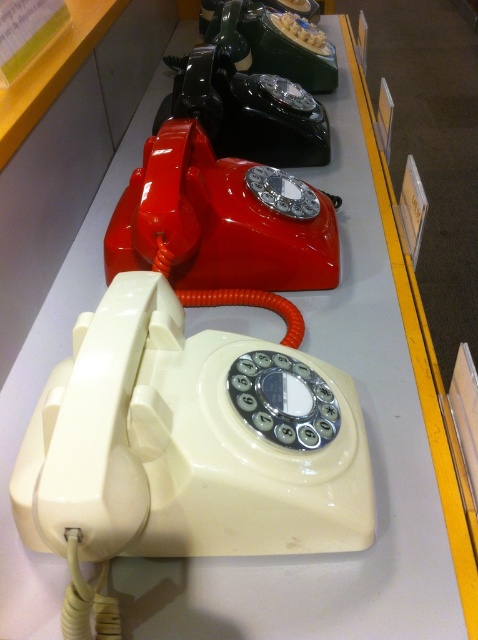
You are a visitor at the museum and want to take a photo of the two points marked in the exhibit. Which point should you focus on first to ensure both are in the frame? Please choose between point (293, 268) and point (259, 45).

You should focus on point (293, 268) first because it is in front of point (259, 45), so it will be easier to capture both in the frame by starting with the closer one.